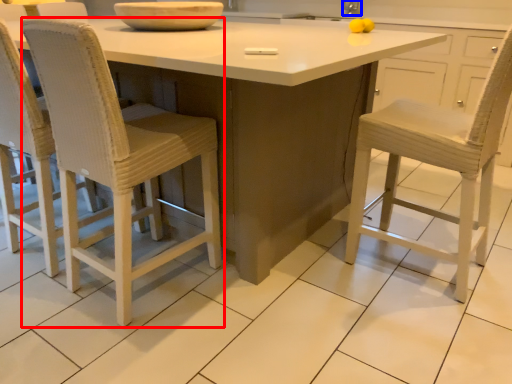
Question: Which object is further to the camera taking this photo, chair (highlighted by a red box) or faucet (highlighted by a blue box)?

Choices:
 (A) chair
 (B) faucet

Answer: (B)